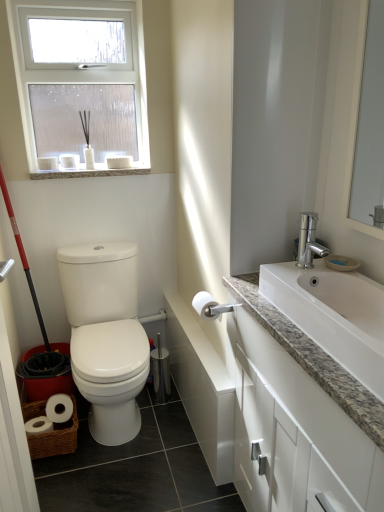
Where is `free spot above woven brown basket at lower left (from a real-world perspective)`? Image resolution: width=384 pixels, height=512 pixels. free spot above woven brown basket at lower left (from a real-world perspective) is located at coordinates (44, 385).